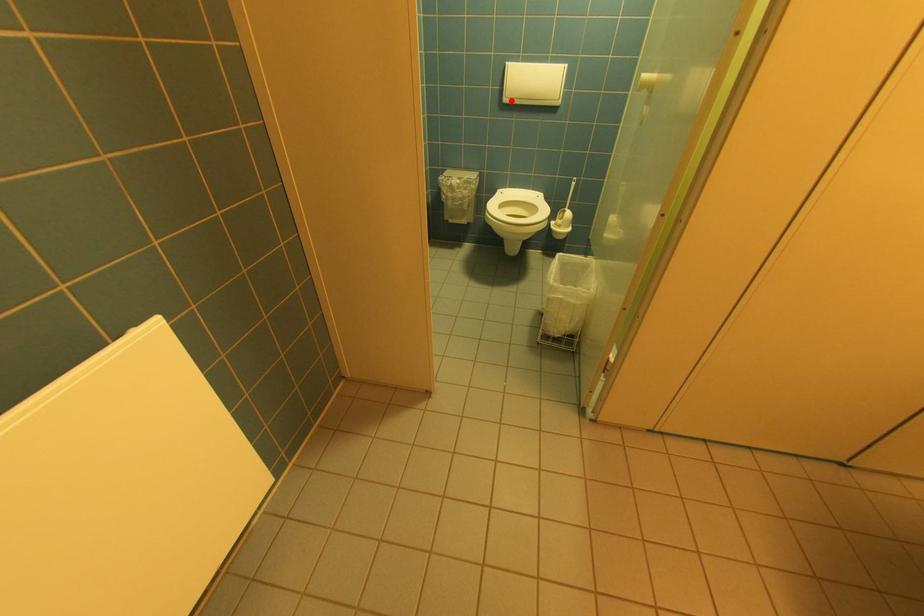
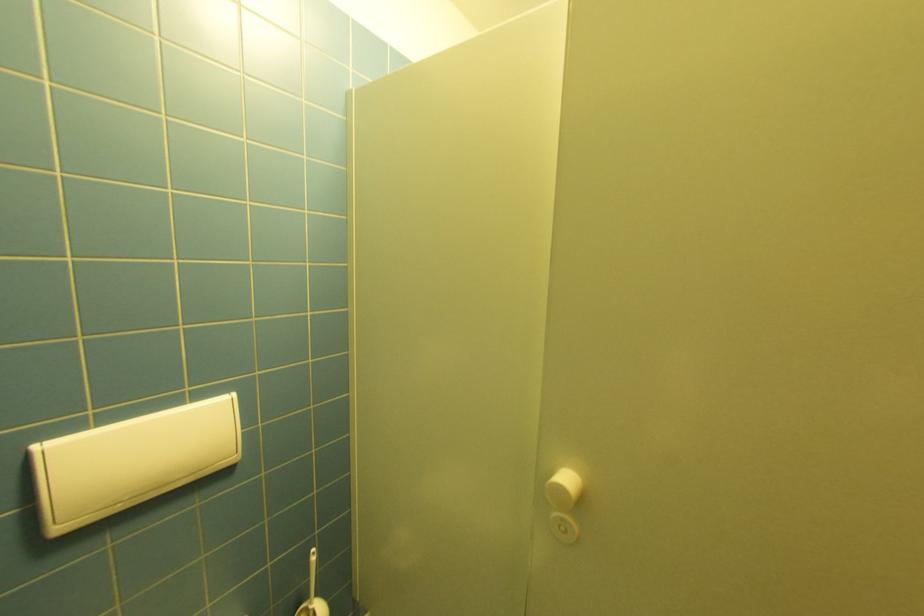
The point at the highlighted location is marked in the first image. Where is the corresponding point in the second image?

(66, 530)